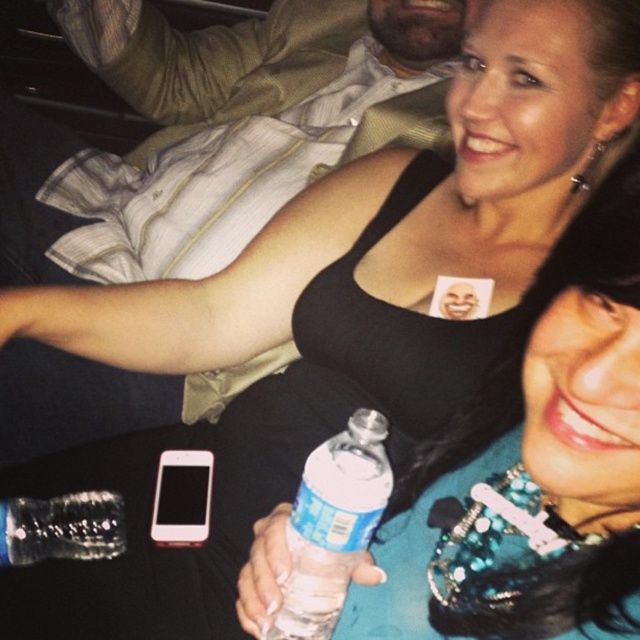
Which of these two, clear plastic bottle at center or clear plastic bottle at lower center, stands taller?

Standing taller between the two is clear plastic bottle at center.

Is point (362, 509) positioned before point (56, 508)?

Yes.

Between point (305, 632) and point (42, 532), which one is positioned in front?

Positioned in front is point (305, 632).

Identify the location of clear plastic bottle at center. (332, 525).